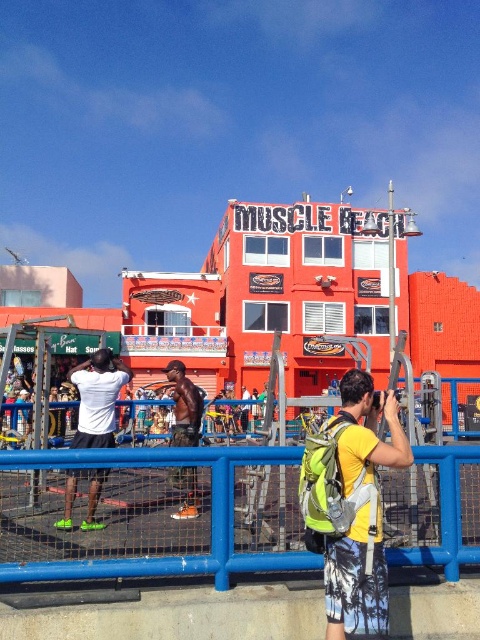
Question: Which object is farther from the camera taking this photo?

Choices:
 (A) shiny black shorts at center
 (B) yellow fabric safety vest at lower right
 (C) black matte shorts at center
 (D) yellow fabric backpack at lower right

Answer: (A)

Question: Is black matte shorts at center bigger than shiny black shorts at center?

Choices:
 (A) no
 (B) yes

Answer: (A)

Question: Does yellow fabric backpack at lower right have a larger size compared to yellow fabric safety vest at lower right?

Choices:
 (A) no
 (B) yes

Answer: (B)

Question: Among these objects, which one is farthest from the camera?

Choices:
 (A) black matte shorts at center
 (B) shiny black shorts at center
 (C) yellow fabric backpack at lower right

Answer: (B)

Question: Which object is farther from the camera taking this photo?

Choices:
 (A) yellow fabric backpack at lower right
 (B) blue metal fence at lower center
 (C) black matte shorts at center

Answer: (C)

Question: Is blue metal fence at lower center further to the viewer compared to black matte shorts at center?

Choices:
 (A) no
 (B) yes

Answer: (A)